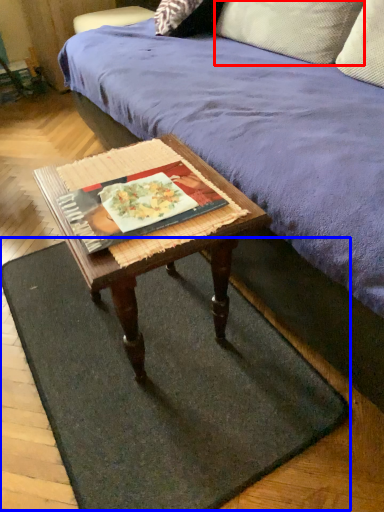
Question: Which object is further to the camera taking this photo, pillow (highlighted by a red box) or doormat (highlighted by a blue box)?

Choices:
 (A) pillow
 (B) doormat

Answer: (A)